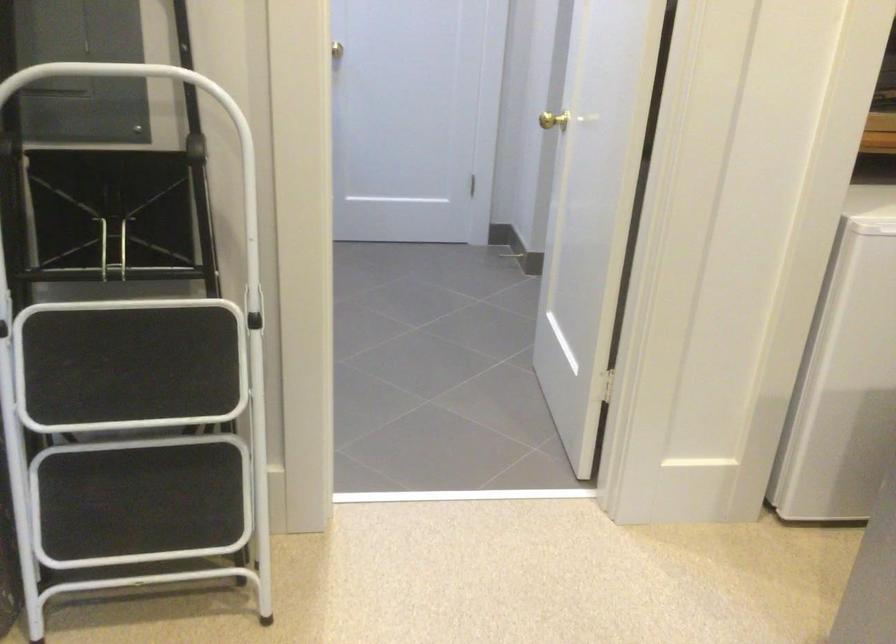
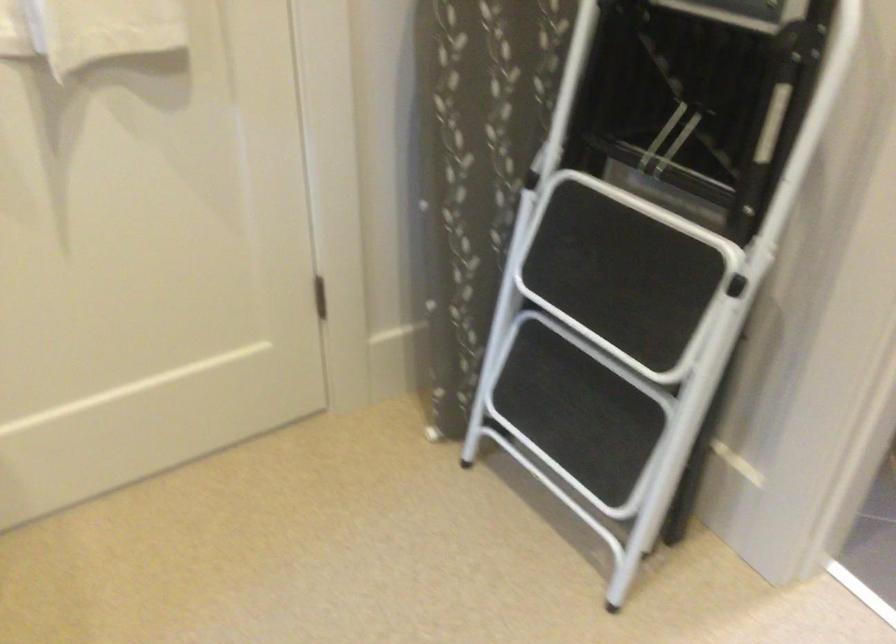
In the second image, find the point that corresponds to point (151, 308) in the first image.

(658, 216)